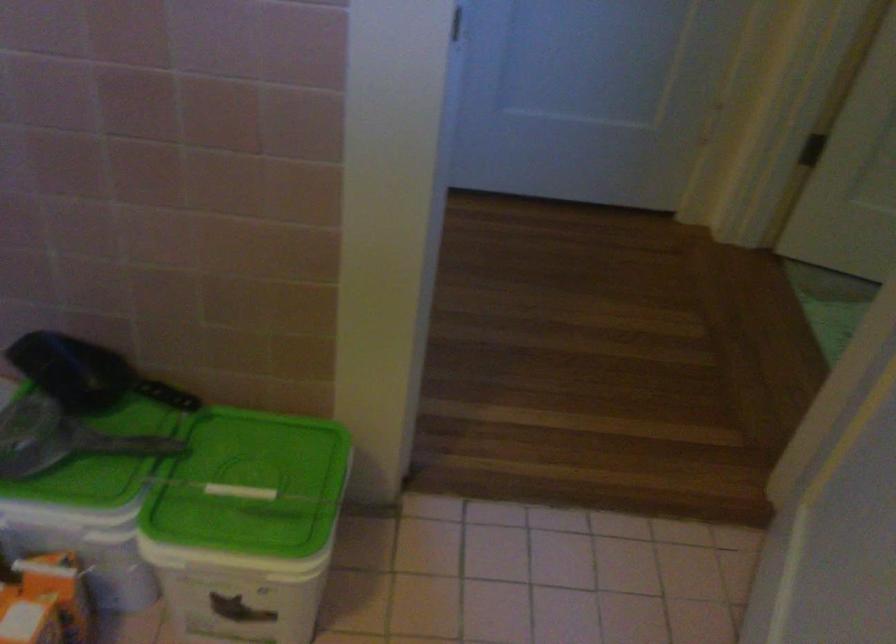
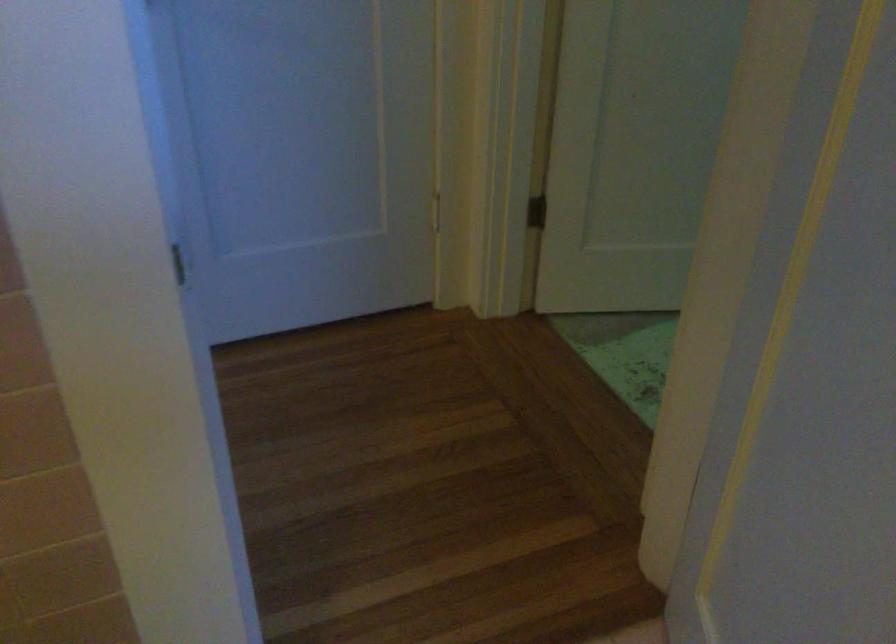
Question: The camera is either moving clockwise (left) or counter-clockwise (right) around the object. The first image is from the beginning of the video and the second image is from the end. Is the camera moving left or right when shooting the video?

Choices:
 (A) Left
 (B) Right

Answer: (A)